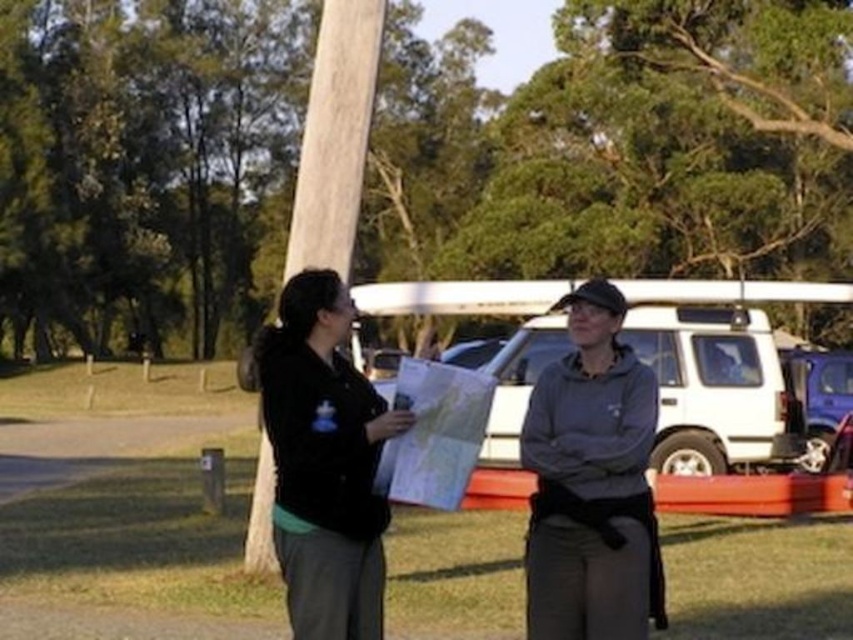
You are planning to take a photo of the gray fleece jacket at center and the white matte suv at center. Which object should you focus on first if you want to capture both in the frame without moving the camera?

You should focus on the gray fleece jacket at center first because it occupies less space than the white matte suv at center, allowing more room to include both in the frame.

You are standing in the park and see the brushed metal pole at center and the black matte jacket at center. Which object is higher up from the ground?

The brushed metal pole at center is located above the black matte jacket at center, so it is higher up from the ground.